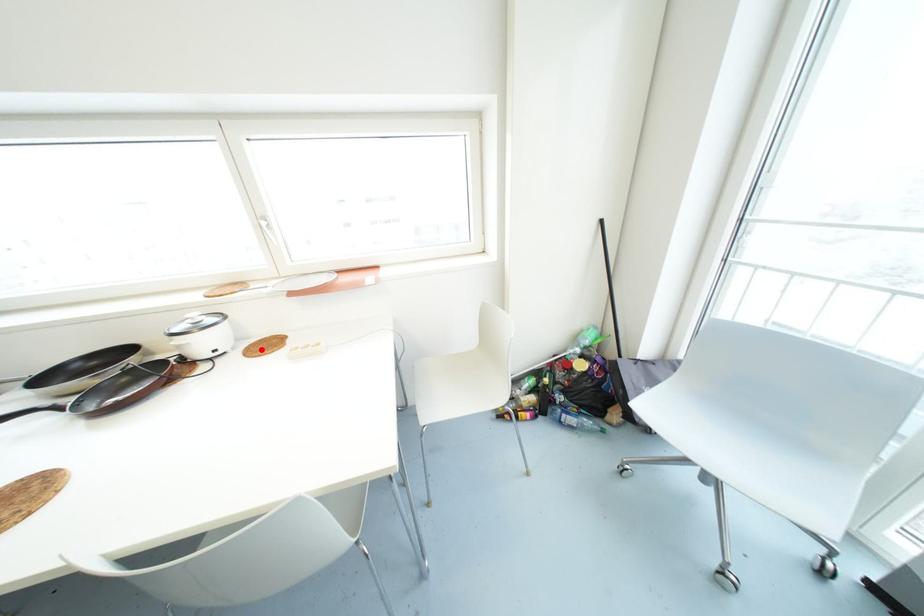
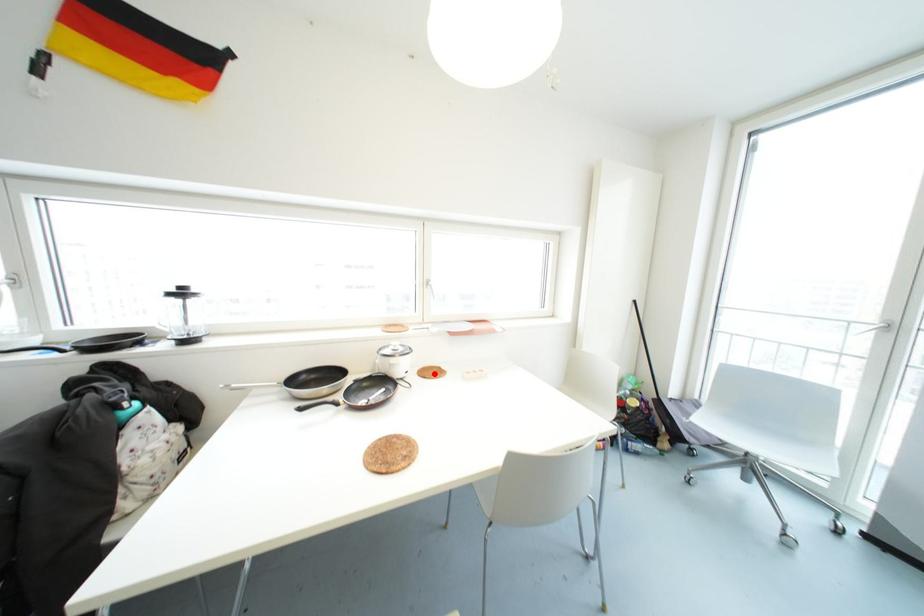
I am providing you with two images of the same scene from different viewpoints. A red point is marked on the first image and another point is marked on the second image. Do the highlighted points in image1 and image2 indicate the same real-world spot?

Yes